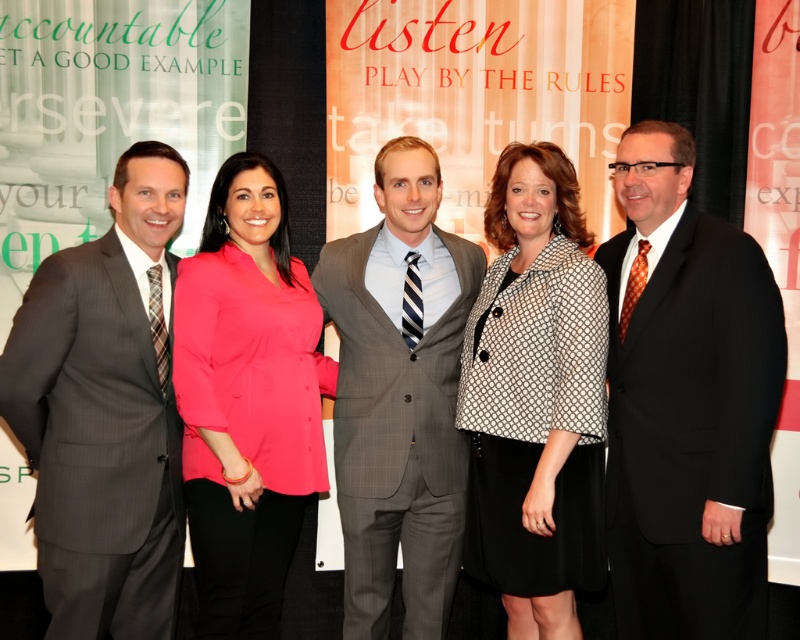
You are a GUI agent. You are given a task and a screenshot of the screen. Output one action in this format:
    pyautogui.click(x=<x>, y=<y>)
    Task: Click on the black pinstripe suit at right
    This screenshot has height=640, width=800.
    Given the screenshot: What is the action you would take?
    pyautogui.click(x=686, y=403)

Between point (768, 291) and point (44, 476), which one is positioned behind?

The point (44, 476) is more distant.

Does point (664, 360) lie in front of point (164, 500)?

That is True.

Locate an element on the screen. black pinstripe suit at right is located at coordinates (686, 403).

Does point (528, 568) lie behind point (458, 429)?

That is False.

You are a GUI agent. You are given a task and a screenshot of the screen. Output one action in this format:
    pyautogui.click(x=<x>, y=<y>)
    Task: Click on the black textured blazer at center
    The width and height of the screenshot is (800, 640).
    Given the screenshot: What is the action you would take?
    pyautogui.click(x=536, y=400)

Is point (598, 534) more distant than point (368, 456)?

No, it is in front of (368, 456).

The image size is (800, 640). In order to click on black textured blazer at center in this screenshot , I will do `click(536, 400)`.

Describe the element at coordinates (686, 403) in the screenshot. The height and width of the screenshot is (640, 800). I see `black pinstripe suit at right` at that location.

Is point (680, 168) closer to camera compared to point (590, 337)?

No, (680, 168) is further to viewer.

Is point (740, 417) positioned behind point (564, 600)?

No.

At what (x,y) coordinates should I click in order to perform the action: click on black pinstripe suit at right. Please return your answer as a coordinate pair (x, y). Image resolution: width=800 pixels, height=640 pixels. Looking at the image, I should click on (686, 403).